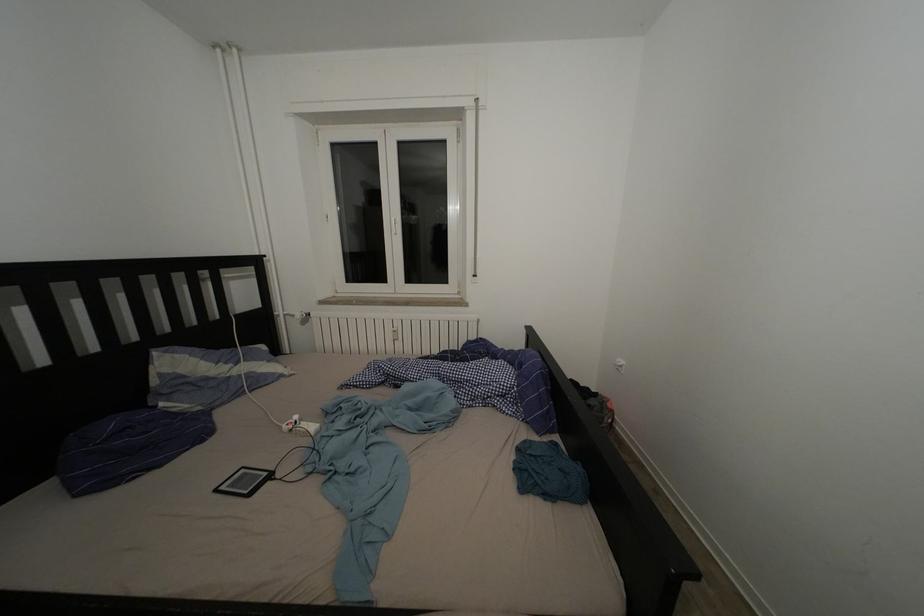
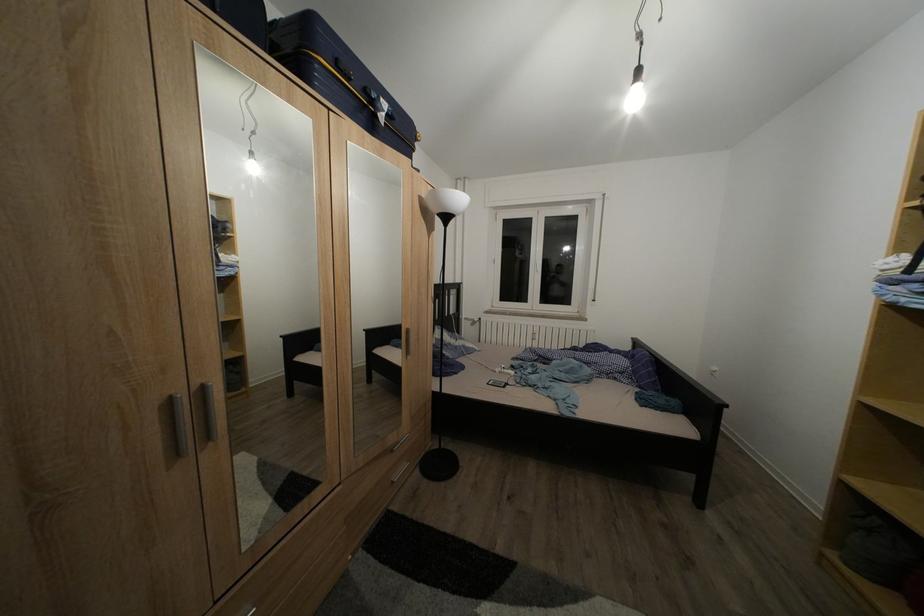
The images are taken continuously from a first-person perspective. In which direction are you moving?

The movement direction of the cameraman is left, backward.